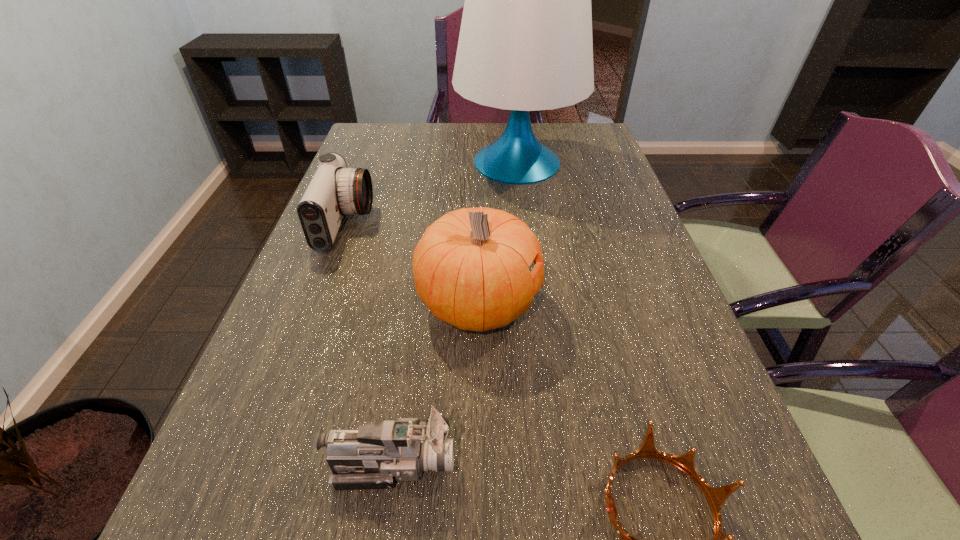
This screenshot has width=960, height=540. Find the location of `free space located on the surface of the third shortest object`. free space located on the surface of the third shortest object is located at coordinates (495, 225).

Where is `blank space located 0.080m on the front-facing side of the right camcorder`? blank space located 0.080m on the front-facing side of the right camcorder is located at coordinates (504, 463).

Find the location of `object that is at the far edge`. object that is at the far edge is located at coordinates coord(525,44).

Find the location of a particular element. The height and width of the screenshot is (540, 960). object located at the left edge is located at coordinates (335, 190).

Where is `object that is at the right edge`? The width and height of the screenshot is (960, 540). object that is at the right edge is located at coordinates (525, 44).

Locate an element on the screen. This screenshot has width=960, height=540. object located at the far right corner is located at coordinates (525, 44).

Locate an element on the screen. This screenshot has height=540, width=960. vacant region at the far edge of the desktop is located at coordinates (491, 132).

In the image, there is a desktop. Where is `vacant space at the right edge`? vacant space at the right edge is located at coordinates (675, 521).

The width and height of the screenshot is (960, 540). I want to click on unoccupied position between the nearer camcorder and the pumpkin, so click(435, 383).

This screenshot has width=960, height=540. I want to click on free space between the nearer camcorder and the pumpkin, so click(x=435, y=383).